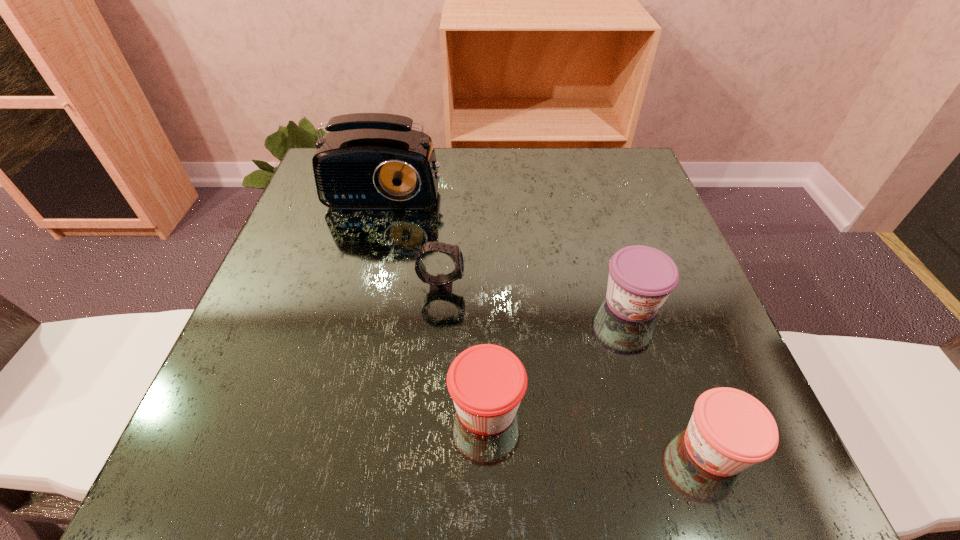
Locate an element on the screen. the tallest object is located at coordinates (366, 160).

The image size is (960, 540). Find the location of `radio receiver`. radio receiver is located at coordinates (366, 160).

The height and width of the screenshot is (540, 960). I want to click on watch, so click(x=441, y=285).

Locate an element on the screen. the farthest jam is located at coordinates (641, 278).

Image resolution: width=960 pixels, height=540 pixels. What are the coordinates of `the leftmost jam` in the screenshot? It's located at (487, 382).

You are a GUI agent. You are given a task and a screenshot of the screen. Output one action in this format:
    pyautogui.click(x=<x>, y=<y>)
    Task: Click on the vacant space located 0.070m on the front-facing side of the tallest object
    This screenshot has height=540, width=960.
    Given the screenshot: What is the action you would take?
    pyautogui.click(x=375, y=233)

Where is `vacant area situated 0.360m on the face of the watch`? vacant area situated 0.360m on the face of the watch is located at coordinates (654, 287).

Locate an element on the screen. The width and height of the screenshot is (960, 540). free space located on the front label of the farthest jam is located at coordinates (688, 483).

Locate an element on the screen. The image size is (960, 540). vacant space located on the label side of the leftmost jam is located at coordinates (265, 407).

The height and width of the screenshot is (540, 960). I want to click on blank space located on the label side of the leftmost jam, so click(364, 407).